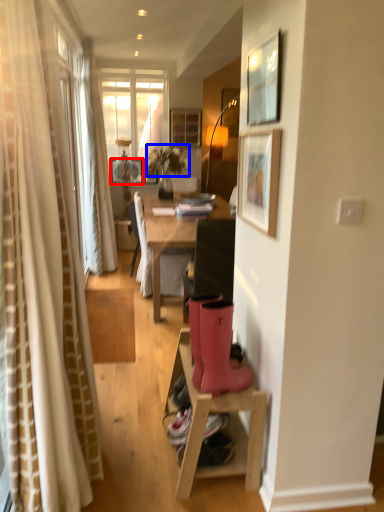
Question: Which point is further to the camera, picture frame (highlighted by a red box) or flower (highlighted by a blue box)?

Choices:
 (A) picture frame
 (B) flower

Answer: (A)